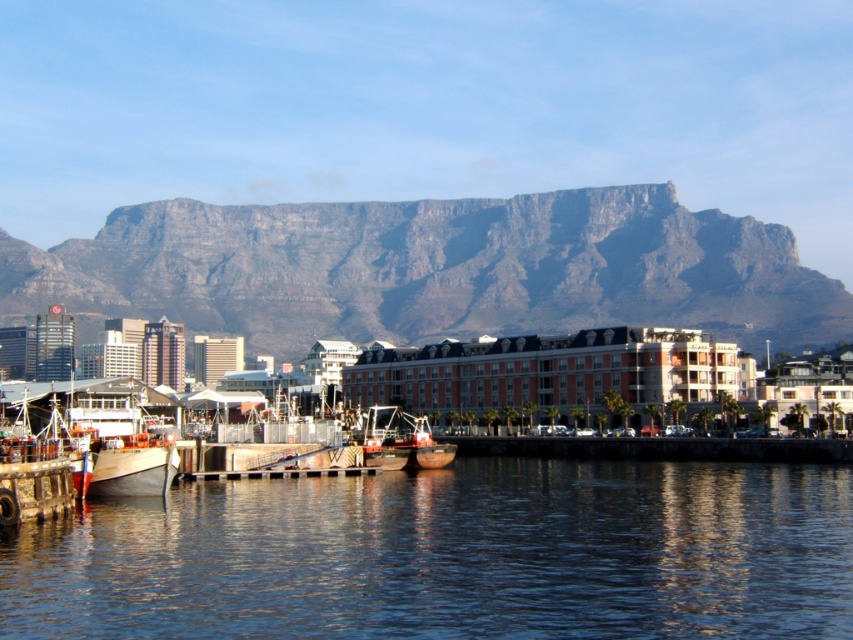
Question: Is blue water at lower center below gray rocky mountain at upper center?

Choices:
 (A) yes
 (B) no

Answer: (A)

Question: Which point is farther to the camera?

Choices:
 (A) (241, 520)
 (B) (775, 310)

Answer: (B)

Question: Is blue water at lower center closer to the viewer compared to metallic gray boat at lower left?

Choices:
 (A) yes
 (B) no

Answer: (A)

Question: Is blue water at lower center smaller than metallic gray boat at lower left?

Choices:
 (A) no
 (B) yes

Answer: (A)

Question: Which object is closer to the camera taking this photo?

Choices:
 (A) metallic polished boat at center
 (B) metallic gray boat at lower left

Answer: (B)

Question: Based on their relative distances, which object is nearer to the metallic polished boat at center?

Choices:
 (A) metallic gray boat at lower left
 (B) gray rocky mountain at upper center

Answer: (A)